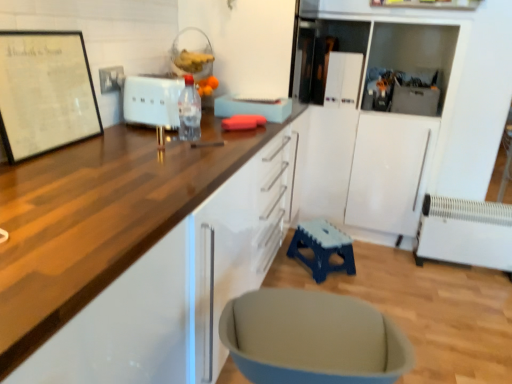
Image resolution: width=512 pixels, height=384 pixels. What are the coordinates of `free area below white plastic radiator at lower right (from a real-world perspective)` in the screenshot? It's located at (466, 273).